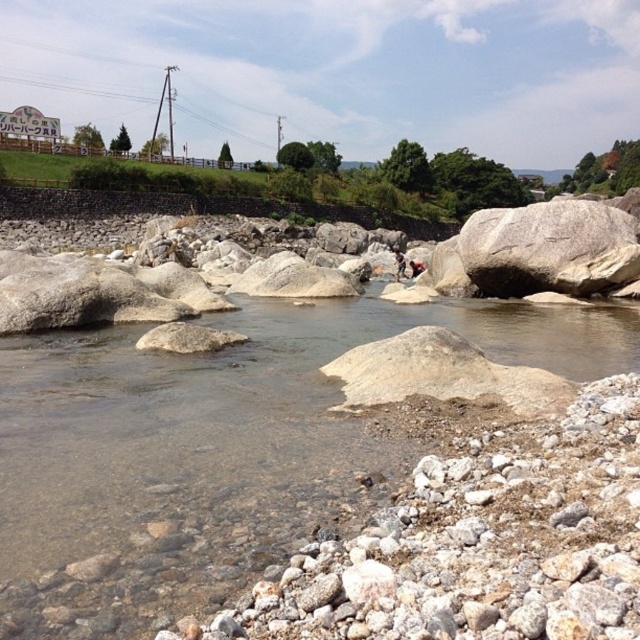
Who is taller, gray granite boulder at center-right or dark brown leather jacket at center?

Standing taller between the two is dark brown leather jacket at center.

Can you confirm if gray granite boulder at center-right is positioned to the left of dark brown leather jacket at center?

No, gray granite boulder at center-right is not to the left of dark brown leather jacket at center.

Between point (620, 236) and point (401, 262), which one is positioned in front?

Point (620, 236)

Find the location of a particular element. gray granite boulder at center-right is located at coordinates (548, 248).

In the scene shown: Which is more to the right, clear water at center or dark brown leather jacket at center?

dark brown leather jacket at center

Which is in front, point (458, 314) or point (396, 266)?

Point (458, 314)

You are a GUI agent. You are given a task and a screenshot of the screen. Output one action in this format:
    pyautogui.click(x=<x>, y=<y>)
    Task: Click on the clear water at center
    
    Given the screenshot: What is the action you would take?
    pyautogui.click(x=218, y=449)

Can you confirm if clear water at center is taller than gray granite boulder at center-right?

No, clear water at center is not taller than gray granite boulder at center-right.

Who is shorter, clear water at center or gray granite boulder at center-right?

Standing shorter between the two is clear water at center.

Does point (28, 512) lie behind point (566, 211)?

No.

The height and width of the screenshot is (640, 640). What are the coordinates of `clear water at center` in the screenshot? It's located at (218, 449).